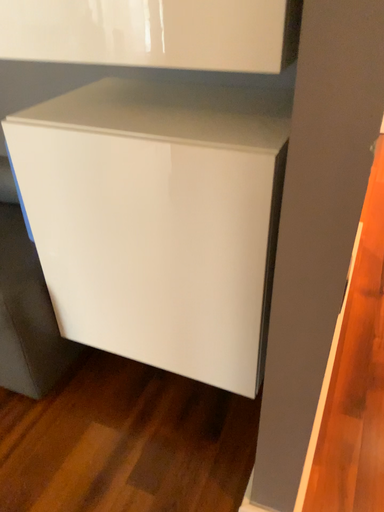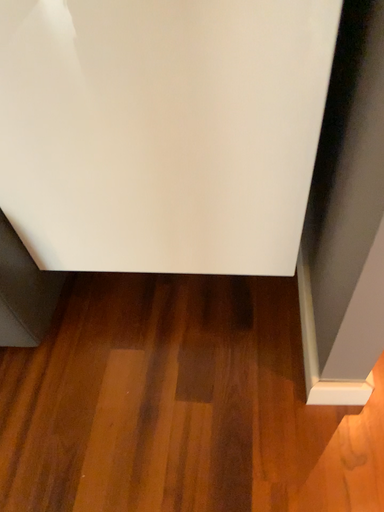
Question: How did the camera likely rotate when shooting the video?

Choices:
 (A) rotated upward
 (B) rotated downward

Answer: (B)